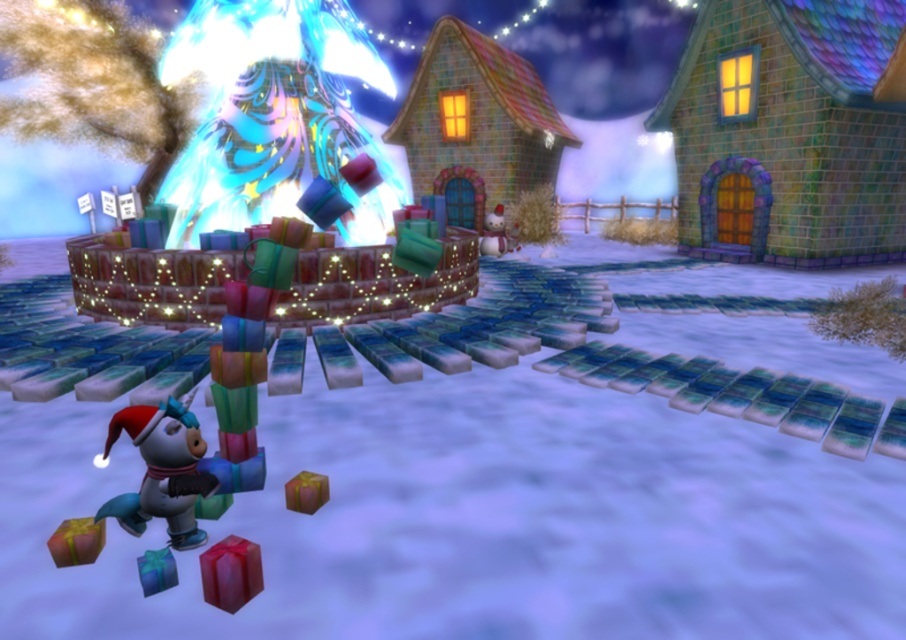
Who is higher up, shiny metallic unicorn at lower left or matte brown gift at lower center?

Positioned higher is shiny metallic unicorn at lower left.

From the picture: Is the position of shiny metallic unicorn at lower left more distant than that of matte brown gift at lower center?

No, it is not.

Who is more forward, (133, 416) or (316, 483)?

Point (133, 416) is in front.

The height and width of the screenshot is (640, 906). Find the location of `shiny metallic unicorn at lower left`. shiny metallic unicorn at lower left is located at coordinates (162, 470).

Does white matte snow at center have a greater height compared to shiny metallic unicorn at lower left?

No.

Which is in front, point (464, 410) or point (203, 444)?

Point (203, 444) is more forward.

Find the location of a particular element. Image resolution: width=906 pixels, height=640 pixels. white matte snow at center is located at coordinates (479, 520).

Who is more forward, [306,499] or [503,248]?

Point [306,499] is in front.

Is point (300, 472) in front of point (516, 234)?

Yes, it is.

At what (x,y) coordinates should I click in order to perform the action: click on matte brown gift at lower center. Please return your answer as a coordinate pair (x, y). Looking at the image, I should click on (306, 492).